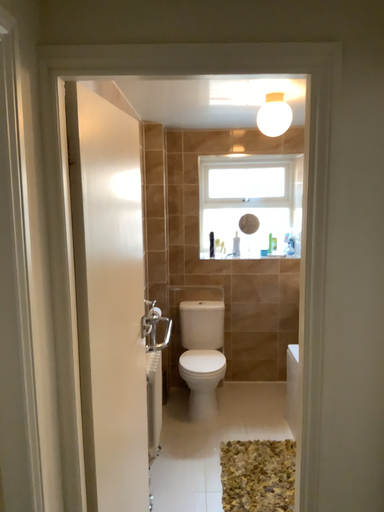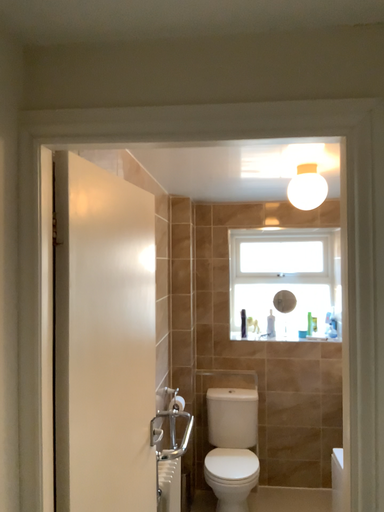
Question: Which way did the camera rotate in the video?

Choices:
 (A) rotated downward
 (B) rotated upward

Answer: (B)